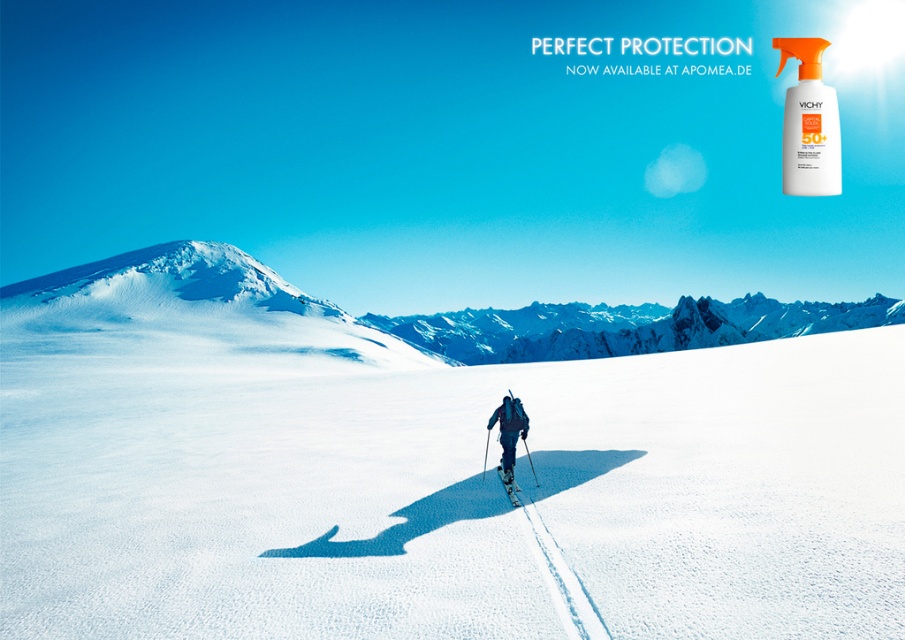
Between white powder snow at center and dark blue ski suit at center, which one appears on the left side from the viewer's perspective?

white powder snow at center is more to the left.

Is point (901, 588) farther from camera compared to point (513, 476)?

No, (901, 588) is in front of (513, 476).

This screenshot has width=905, height=640. Identify the location of white powder snow at center. (458, 497).

Who is more forward, (62, 554) or (787, 154)?

Point (62, 554)

Which is behind, point (319, 598) or point (827, 112)?

Point (827, 112)

Based on the photo, who is more distant from viewer, [827,589] or [832,140]?

The point [832,140] is behind.

The width and height of the screenshot is (905, 640). I want to click on white powder snow at center, so click(x=458, y=497).

How much distance is there between white snow-covered mountain at center and dark blue ski suit at center?

white snow-covered mountain at center is 138.95 meters from dark blue ski suit at center.

Who is lower down, white snow-covered mountain at center or dark blue ski suit at center?

dark blue ski suit at center

Image resolution: width=905 pixels, height=640 pixels. What do you see at coordinates (470, 310) in the screenshot?
I see `white snow-covered mountain at center` at bounding box center [470, 310].

The width and height of the screenshot is (905, 640). I want to click on white snow-covered mountain at center, so click(470, 310).